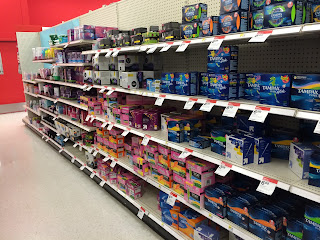
Identify the location of blue wall. The width and height of the screenshot is (320, 240). (44, 41).